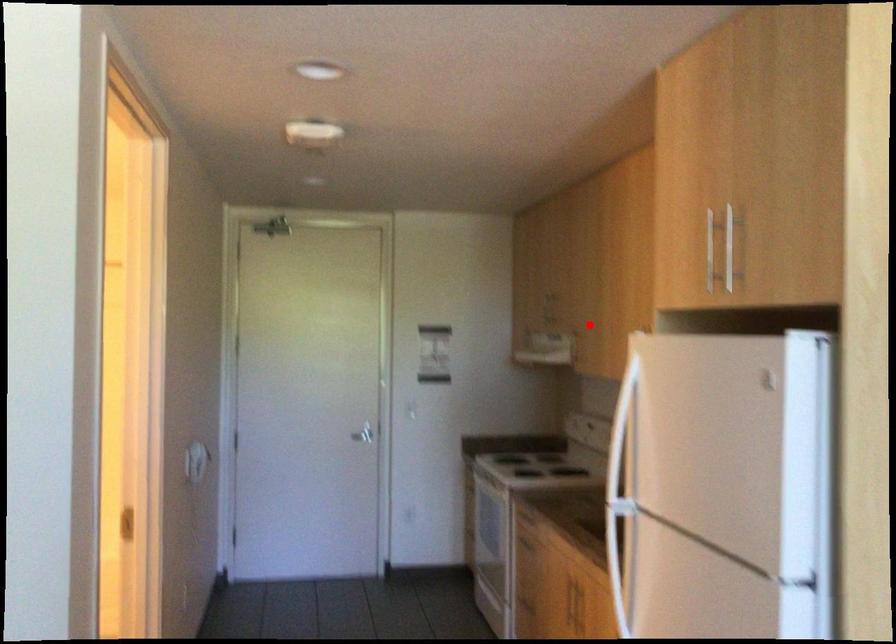
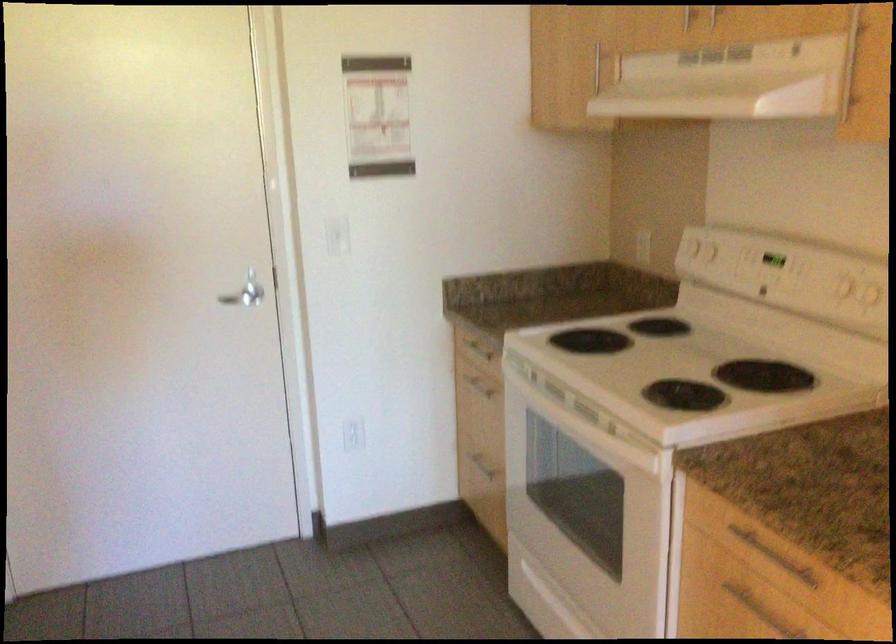
Question: I am providing you with two images of the same scene from different viewpoints. Given a red point in image1, look at the same physical point in image2. Is it:

Choices:
 (A) Closer to the viewpoint
 (B) Farther from the viewpoint

Answer: (A)